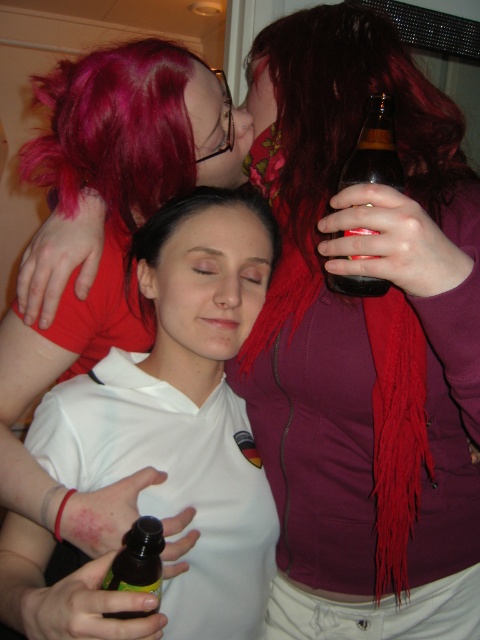
You are at a party and see the white matte shirt at center and the translucent plastic bottle at center. Which object is closer to the left side of the image?

The white matte shirt at center is closer to the left side of the image because it is positioned to the left of the translucent plastic bottle at center.

You are standing in the room and want to move from point A to point B. Point A is at coordinate point (363, 148) and point B is at coordinate point (140, 529). Which point is closer to you?

Point B at coordinate point (140, 529) is closer to you because it is nearer to the camera than point A at coordinate point (363, 148).